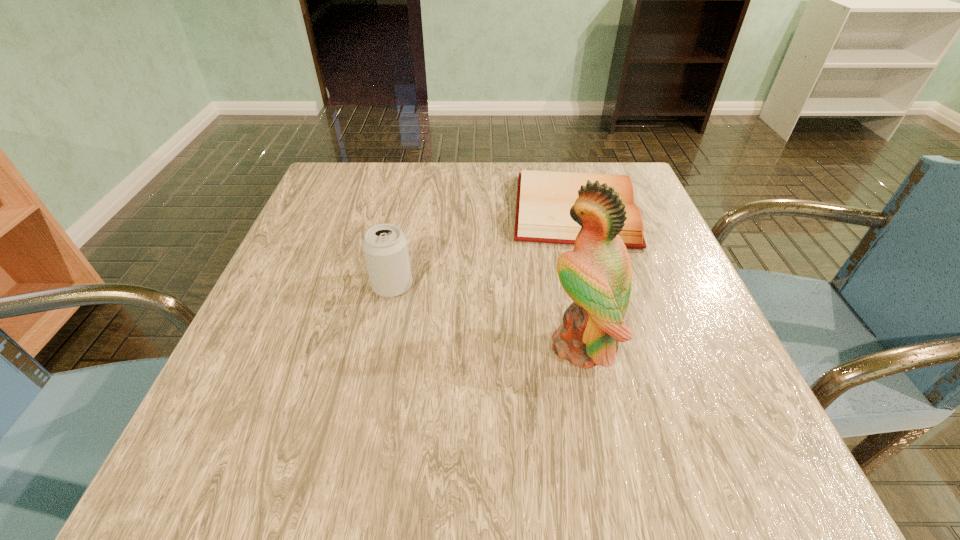
You are a GUI agent. You are given a task and a screenshot of the screen. Output one action in this format:
    pyautogui.click(x=<x>, y=<y>)
    Task: Click on the parrot
    Image resolution: width=960 pixels, height=540 pixels.
    Given the screenshot: What is the action you would take?
    pyautogui.click(x=597, y=276)

This screenshot has height=540, width=960. I want to click on the nearest object, so click(x=597, y=276).

Locate an element on the screen. can is located at coordinates (385, 247).

You are a GUI agent. You are given a task and a screenshot of the screen. Output one action in this format:
    pyautogui.click(x=<x>, y=<y>)
    Task: Click on the second tallest object
    This screenshot has width=960, height=540.
    Given the screenshot: What is the action you would take?
    pyautogui.click(x=385, y=247)

Find the location of a particular element. The height and width of the screenshot is (540, 960). the farthest object is located at coordinates (544, 198).

The height and width of the screenshot is (540, 960). Identify the location of Bible. (544, 198).

Where is `vacant space located on the front-facing side of the nearest object`? vacant space located on the front-facing side of the nearest object is located at coordinates (324, 345).

Image resolution: width=960 pixels, height=540 pixels. What are the coordinates of `vacant space located 0.320m on the front-facing side of the nearest object` in the screenshot? It's located at (353, 345).

What are the coordinates of `free space located on the front-facing side of the nearest object` in the screenshot? It's located at (408, 345).

Find the location of a particular element. The width and height of the screenshot is (960, 540). vacant space located on the front of the leftmost object is located at coordinates (383, 330).